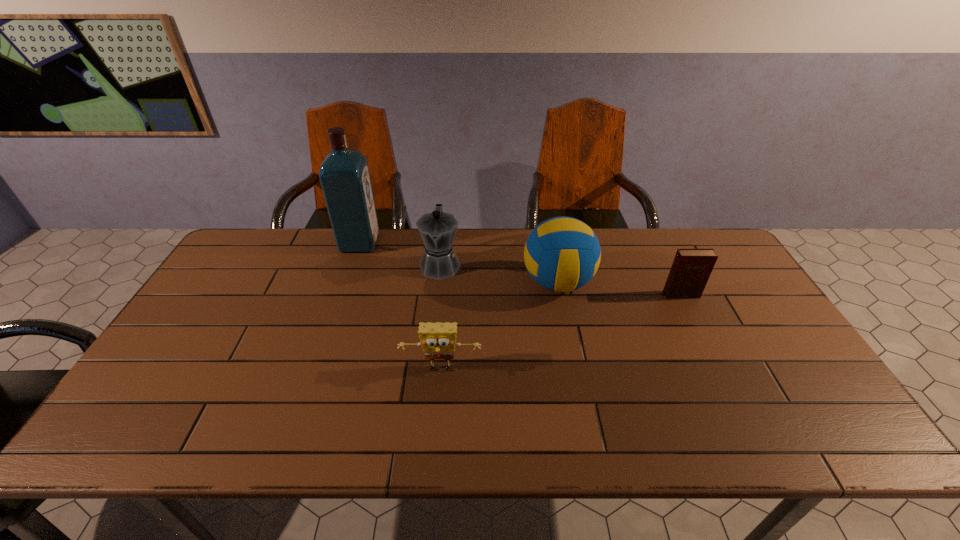
I want to click on vacant region that satisfies the following two spatial constraints: 1. at the spout of the coffeepot; 2. on the right side of the second object from right to left, so click(439, 282).

The width and height of the screenshot is (960, 540). Find the location of `blank space that satisfies the following two spatial constraints: 1. on the flat label side of the tallest object; 2. on the back side of the volleyball`. blank space that satisfies the following two spatial constraints: 1. on the flat label side of the tallest object; 2. on the back side of the volleyball is located at coordinates (347, 282).